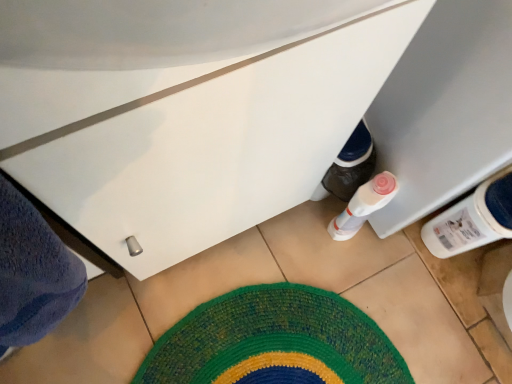
You are a GUI agent. You are given a task and a screenshot of the screen. Output one action in this format:
    pyautogui.click(x=<x>, y=<y>)
    Task: Click on the vacant area on top of multicolored woven mat at center (from a real-world perspective)
    The width and height of the screenshot is (512, 384).
    Given the screenshot: What is the action you would take?
    pyautogui.click(x=292, y=349)